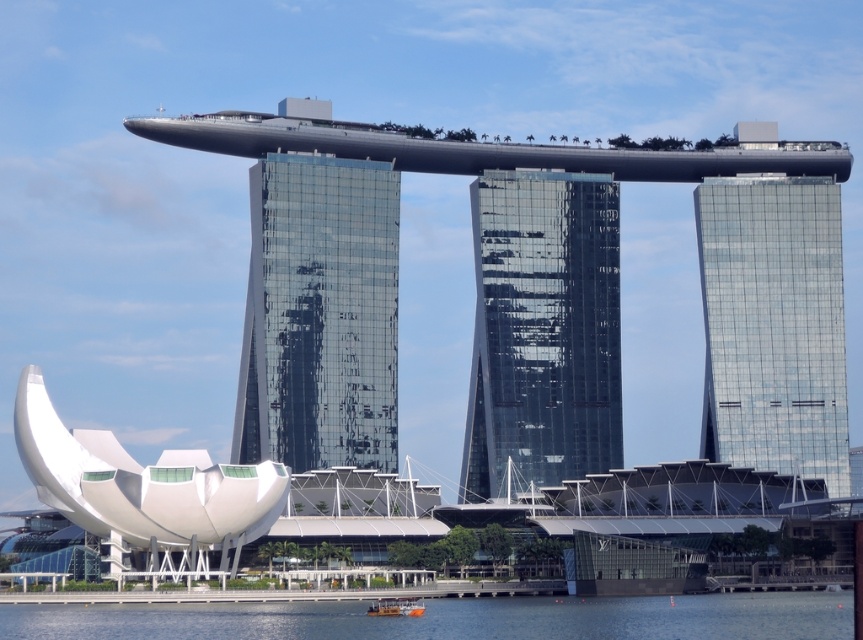
Question: Is clear blue water at lower center positioned before yellow matte boat at lower center?

Choices:
 (A) yes
 (B) no

Answer: (A)

Question: Can you confirm if shiny glass skyscraper at center is positioned to the left of clear blue water at lower center?

Choices:
 (A) yes
 (B) no

Answer: (B)

Question: Which of the following is the closest to the observer?

Choices:
 (A) (811, 196)
 (B) (413, 605)
 (C) (545, 349)

Answer: (B)

Question: Which is farther from the transparent glass building at center?

Choices:
 (A) yellow matte boat at lower center
 (B) transparent glass skyscraper at right

Answer: (A)

Question: Which object is closer to the camera taking this photo?

Choices:
 (A) shiny glass skyscraper at center
 (B) clear blue water at lower center

Answer: (B)

Question: Does transparent glass building at center come in front of shiny glass skyscraper at center?

Choices:
 (A) no
 (B) yes

Answer: (B)